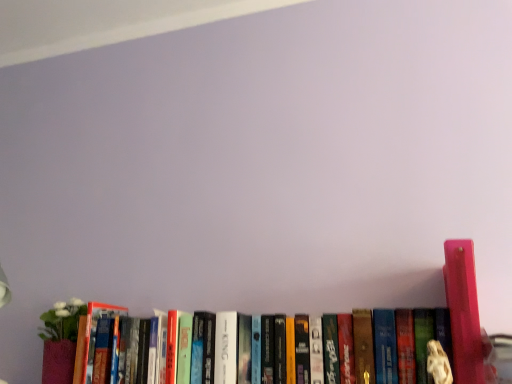
Where is `hardcover book at center, placed as the 1th book when sorted from left to right`? The height and width of the screenshot is (384, 512). hardcover book at center, placed as the 1th book when sorted from left to right is located at coordinates (200, 348).

What do you see at coordinates (200, 348) in the screenshot?
I see `hardcover book at center, acting as the 2th book starting from the right` at bounding box center [200, 348].

The width and height of the screenshot is (512, 384). What do you see at coordinates (463, 311) in the screenshot? I see `pink plastic figurine at right, which ranks as the first book in right-to-left order` at bounding box center [463, 311].

Identify the location of pink plastic figurine at right, which ranks as the first book in right-to-left order. (463, 311).

What are the coordinates of `hardcover book at center, acting as the 2th book starting from the right` in the screenshot? It's located at (200, 348).

Between hardcover book at center, placed as the 1th book when sorted from left to right, and pink plastic figurine at right, the 2th book from the left, which one appears on the right side from the viewer's perspective?

pink plastic figurine at right, the 2th book from the left, is more to the right.

Is hardcover book at center, placed as the 1th book when sorted from left to right, positioned in front of pink plastic figurine at right, which ranks as the first book in right-to-left order?

No, the depth of hardcover book at center, placed as the 1th book when sorted from left to right, is greater than that of pink plastic figurine at right, which ranks as the first book in right-to-left order.

Is point (194, 366) farther from camera compared to point (461, 338)?

Yes, point (194, 366) is behind point (461, 338).

From the image's perspective, is hardcover book at center, acting as the 2th book starting from the right, positioned above or below pink plastic figurine at right, the 2th book from the left?

From the image's perspective, hardcover book at center, acting as the 2th book starting from the right, appears below pink plastic figurine at right, the 2th book from the left.

From a real-world perspective, is hardcover book at center, placed as the 1th book when sorted from left to right, physically located above or below pink plastic figurine at right, the 2th book from the left?

hardcover book at center, placed as the 1th book when sorted from left to right, is below pink plastic figurine at right, the 2th book from the left.

Is hardcover book at center, placed as the 1th book when sorted from left to right, wider than pink plastic figurine at right, which ranks as the first book in right-to-left order?

In fact, hardcover book at center, placed as the 1th book when sorted from left to right, might be narrower than pink plastic figurine at right, which ranks as the first book in right-to-left order.

Based on the photo, between hardcover book at center, acting as the 2th book starting from the right, and pink plastic figurine at right, the 2th book from the left, which one has more height?

pink plastic figurine at right, the 2th book from the left, is taller.

Does hardcover book at center, placed as the 1th book when sorted from left to right, have a smaller size compared to pink plastic figurine at right, the 2th book from the left?

No, hardcover book at center, placed as the 1th book when sorted from left to right, is not smaller than pink plastic figurine at right, the 2th book from the left.

Looking at this image, would you say pink plastic figurine at right, the 2th book from the left, is part of hardcover book at center, acting as the 2th book starting from the right,'s contents?

No.

Is hardcover book at center, acting as the 2th book starting from the right, placed right next to pink plastic figurine at right, which ranks as the first book in right-to-left order?

No.

Is hardcover book at center, placed as the 1th book when sorted from left to right, oriented away from pink plastic figurine at right, which ranks as the first book in right-to-left order?

No, hardcover book at center, placed as the 1th book when sorted from left to right,'s orientation is not away from pink plastic figurine at right, which ranks as the first book in right-to-left order.

Where is `book lying on the left of pink plastic figurine at right, the 2th book from the left`? The image size is (512, 384). book lying on the left of pink plastic figurine at right, the 2th book from the left is located at coordinates (200, 348).

Is pink plastic figurine at right, which ranks as the first book in right-to-left order, to the right of hardcover book at center, acting as the 2th book starting from the right, from the viewer's perspective?

Yes.

In the scene shown: Relative to hardcover book at center, acting as the 2th book starting from the right, is pink plastic figurine at right, which ranks as the first book in right-to-left order, in front or behind?

Visually, pink plastic figurine at right, which ranks as the first book in right-to-left order, is located in front of hardcover book at center, acting as the 2th book starting from the right.

Which is behind, point (471, 256) or point (262, 334)?

The point (262, 334) is behind.

From the image's perspective, which object appears higher, pink plastic figurine at right, the 2th book from the left, or hardcover book at center, acting as the 2th book starting from the right?

pink plastic figurine at right, the 2th book from the left, appears higher in the image.

From a real-world perspective, does pink plastic figurine at right, the 2th book from the left, sit lower than hardcover book at center, placed as the 1th book when sorted from left to right?

No, from a real-world perspective, pink plastic figurine at right, the 2th book from the left, is not below hardcover book at center, placed as the 1th book when sorted from left to right.

Considering the relative sizes of pink plastic figurine at right, which ranks as the first book in right-to-left order, and hardcover book at center, placed as the 1th book when sorted from left to right, in the image provided, is pink plastic figurine at right, which ranks as the first book in right-to-left order, thinner than hardcover book at center, placed as the 1th book when sorted from left to right,?

In fact, pink plastic figurine at right, which ranks as the first book in right-to-left order, might be wider than hardcover book at center, placed as the 1th book when sorted from left to right.

Between pink plastic figurine at right, which ranks as the first book in right-to-left order, and hardcover book at center, acting as the 2th book starting from the right, which one has more height?

Standing taller between the two is pink plastic figurine at right, which ranks as the first book in right-to-left order.

Is pink plastic figurine at right, the 2th book from the left, bigger than hardcover book at center, acting as the 2th book starting from the right?

Incorrect, pink plastic figurine at right, the 2th book from the left, is not larger than hardcover book at center, acting as the 2th book starting from the right.

Which is correct: pink plastic figurine at right, the 2th book from the left, is inside hardcover book at center, placed as the 1th book when sorted from left to right, or outside of it?

pink plastic figurine at right, the 2th book from the left, cannot be found inside hardcover book at center, placed as the 1th book when sorted from left to right.

Is pink plastic figurine at right, which ranks as the first book in right-to-left order, next to hardcover book at center, acting as the 2th book starting from the right?

No, pink plastic figurine at right, which ranks as the first book in right-to-left order, is not making contact with hardcover book at center, acting as the 2th book starting from the right.

Is pink plastic figurine at right, which ranks as the first book in right-to-left order, looking in the opposite direction of hardcover book at center, acting as the 2th book starting from the right?

pink plastic figurine at right, which ranks as the first book in right-to-left order, is not turned away from hardcover book at center, acting as the 2th book starting from the right.

This screenshot has height=384, width=512. What are the coordinates of `book on the left of pink plastic figurine at right, which ranks as the first book in right-to-left order` in the screenshot? It's located at (200, 348).

The image size is (512, 384). I want to click on book that is in front of the hardcover book at center, acting as the 2th book starting from the right, so click(x=463, y=311).

Identify the location of book above the hardcover book at center, acting as the 2th book starting from the right (from the image's perspective). The height and width of the screenshot is (384, 512). (463, 311).